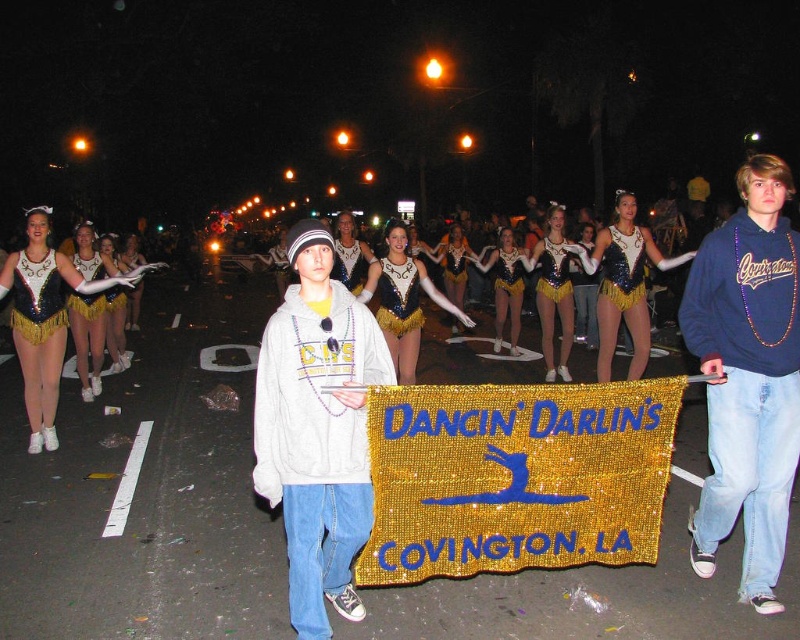
Is blue fleece sweatshirt at center closer to the viewer compared to white fleece hoodie at center?

No, blue fleece sweatshirt at center is behind white fleece hoodie at center.

Locate an element on the screen. The width and height of the screenshot is (800, 640). blue fleece sweatshirt at center is located at coordinates (748, 378).

Does point (704, 525) come farther from viewer compared to point (333, 307)?

Yes, it is behind point (333, 307).

The height and width of the screenshot is (640, 800). Identify the location of blue fleece sweatshirt at center. (748, 378).

Can you confirm if sequined gold leotard at left is shorter than sequined gold skirt at center?

Incorrect, sequined gold leotard at left's height does not fall short of sequined gold skirt at center's.

Image resolution: width=800 pixels, height=640 pixels. Find the location of `sequined gold leotard at left`. sequined gold leotard at left is located at coordinates (44, 320).

Between blue fleece sweatshirt at center and sequined gold leotard at left, which one appears on the left side from the viewer's perspective?

sequined gold leotard at left is more to the left.

Does point (754, 172) come behind point (20, 316)?

No, it is in front of (20, 316).

The image size is (800, 640). In order to click on blue fleece sweatshirt at center in this screenshot , I will do `click(748, 378)`.